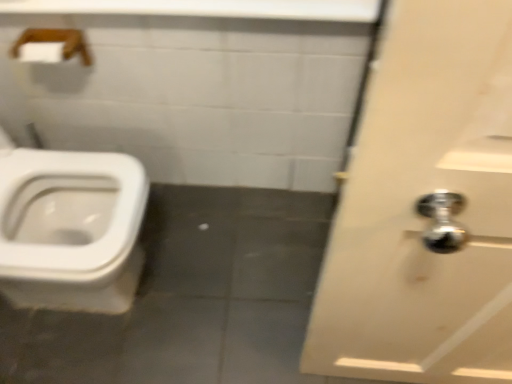
Question: Relative to wooden towel bar at upper left, is white glossy door at right in front or behind?

Choices:
 (A) behind
 (B) front

Answer: (B)

Question: Considering the positions of white glossy door at right and wooden towel bar at upper left in the image, is white glossy door at right wider or thinner than wooden towel bar at upper left?

Choices:
 (A) wide
 (B) thin

Answer: (B)

Question: Which object is positioned farthest from the white glossy door at right?

Choices:
 (A) wooden towel bar at upper left
 (B) white glossy counter top at upper center

Answer: (A)

Question: Based on their relative distances, which object is nearer to the white glossy door at right?

Choices:
 (A) wooden towel bar at upper left
 (B) white glossy counter top at upper center

Answer: (B)